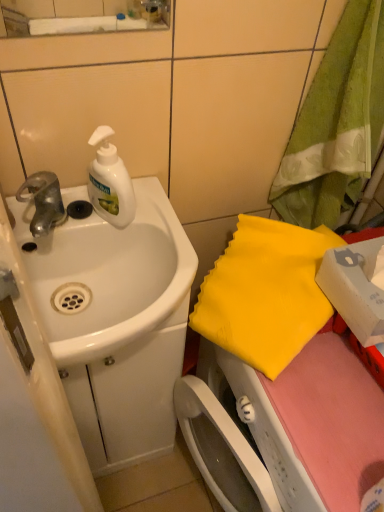
Question: Would you say yellow fabric at right, the 1th beach towel positioned from the bottom, is inside or outside white glossy sink at left?

Choices:
 (A) outside
 (B) inside

Answer: (A)

Question: Is point (233, 259) closer or farther from the camera than point (160, 211)?

Choices:
 (A) closer
 (B) farther

Answer: (B)

Question: Which of these objects is positioned farthest from the yellow fabric at right, the 1th beach towel positioned from the bottom?

Choices:
 (A) silver metallic faucet at left
 (B) green fabric towel at upper right, which ranks as the 2th beach towel in bottom-to-top order
 (C) white glossy sink at left
 (D) white matte soap dispenser at upper left

Answer: (A)

Question: Considering the real-world distances, which object is farthest from the green fabric towel at upper right, which ranks as the 2th beach towel in bottom-to-top order?

Choices:
 (A) yellow fabric at right, the 1th beach towel positioned from the bottom
 (B) white glossy sink at left
 (C) silver metallic faucet at left
 (D) white matte soap dispenser at upper left

Answer: (C)